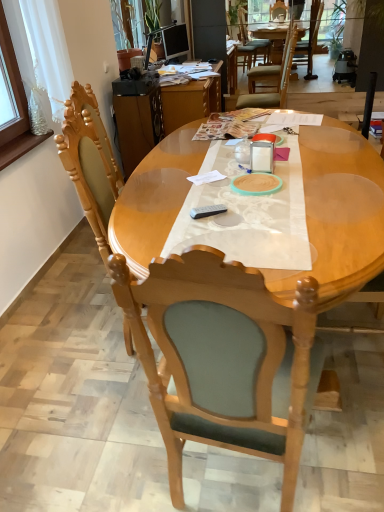
Locate an element on the screen. wooden desk at center is located at coordinates (162, 115).

What do you see at coordinates (223, 360) in the screenshot?
I see `wooden chair at center, which appears as the first chair when viewed from the left` at bounding box center [223, 360].

Describe the element at coordinates (271, 77) in the screenshot. Image resolution: width=384 pixels, height=512 pixels. I see `green fabric chair at upper center, positioned as the 1th chair in back-to-front order` at that location.

You are a GUI agent. You are given a task and a screenshot of the screen. Output one action in this format:
    pyautogui.click(x=<x>, y=<y>)
    Task: Click on the wooden desk at center
    This screenshot has height=512, width=384.
    Given the screenshot: What is the action you would take?
    pyautogui.click(x=162, y=115)

Is there a large distance between wooden chair at center, which is counted as the first chair, starting from the front, and light wood table at center?

Actually, wooden chair at center, which is counted as the first chair, starting from the front, and light wood table at center are a little close together.

Which is more to the left, wooden chair at center, marked as the second chair in a right-to-left arrangement, or light wood table at center?

Positioned to the left is wooden chair at center, marked as the second chair in a right-to-left arrangement.

Is the position of wooden chair at center, marked as the 1th chair in a bottom-to-top arrangement, more distant than that of light wood table at center?

No, wooden chair at center, marked as the 1th chair in a bottom-to-top arrangement, is closer to the camera.

Who is taller, green fabric chair at upper center, which is the 2th chair from left to right, or light wood table at center?

With more height is light wood table at center.

Locate an element on the screen. The height and width of the screenshot is (512, 384). kitchen & dining room table below the green fabric chair at upper center, the 2th chair when ordered from front to back (from the image's perspective) is located at coordinates (338, 214).

Is the position of green fabric chair at upper center, which ranks as the first chair in right-to-left order, less distant than that of light wood table at center?

No, it is not.

Is green fabric chair at upper center, which ranks as the first chair in right-to-left order, positioned with its back to light wood table at center?

green fabric chair at upper center, which ranks as the first chair in right-to-left order, does not have its back to light wood table at center.

Is wooden chair at center, placed as the 2th chair when sorted from back to front, at the right side of wooden desk at center?

Indeed, wooden chair at center, placed as the 2th chair when sorted from back to front, is positioned on the right side of wooden desk at center.

Which of these two, wooden chair at center, which is counted as the first chair, starting from the front, or wooden desk at center, stands taller?

With more height is wooden chair at center, which is counted as the first chair, starting from the front.

Is wooden chair at center, which appears as the first chair when viewed from the left, in contact with wooden desk at center?

There is a gap between wooden chair at center, which appears as the first chair when viewed from the left, and wooden desk at center.

Image resolution: width=384 pixels, height=512 pixels. What are the coordinates of `chair below the wooden desk at center (from the image's perspective)` in the screenshot? It's located at (223, 360).

Can you tell me how much wooden chair at center, placed as the 2th chair when sorted from back to front, and green fabric chair at upper center, which is the 2th chair from left to right, differ in facing direction?

100 degrees.

The width and height of the screenshot is (384, 512). Find the location of `chair below the green fabric chair at upper center, which ranks as the first chair in right-to-left order (from the image's perspective)`. chair below the green fabric chair at upper center, which ranks as the first chair in right-to-left order (from the image's perspective) is located at coordinates (223, 360).

Does point (176, 301) come closer to viewer compared to point (286, 88)?

That is True.

Which object is wider, wooden chair at center, marked as the second chair in a right-to-left arrangement, or green fabric chair at upper center, positioned as the 1th chair in back-to-front order?

green fabric chair at upper center, positioned as the 1th chair in back-to-front order, is wider.

Considering the sizes of wooden desk at center and wooden chair at center, placed as the 2th chair when sorted from back to front, in the image, is wooden desk at center taller or shorter than wooden chair at center, placed as the 2th chair when sorted from back to front,?

Considering their sizes, wooden desk at center has less height than wooden chair at center, placed as the 2th chair when sorted from back to front.

Is point (184, 122) in front of point (122, 286)?

That is False.

Is wooden desk at center facing towards wooden chair at center, which is counted as the first chair, starting from the front?

No, wooden desk at center does not turn towards wooden chair at center, which is counted as the first chair, starting from the front.

Are wooden desk at center and wooden chair at center, which is the 2th chair in top-to-bottom order, far apart?

Yes, wooden desk at center and wooden chair at center, which is the 2th chair in top-to-bottom order, are located far from each other.

Is green fabric chair at upper center, which ranks as the first chair in right-to-left order, positioned beyond the bounds of wooden chair at center, placed as the 2th chair when sorted from back to front?

Yes, green fabric chair at upper center, which ranks as the first chair in right-to-left order, is outside of wooden chair at center, placed as the 2th chair when sorted from back to front.

Considering the points (250, 92) and (189, 251), which point is behind, point (250, 92) or point (189, 251)?

The point (250, 92) is behind.

Is the position of green fabric chair at upper center, positioned as the 2th chair in bottom-to-top order, less distant than that of wooden chair at center, placed as the 2th chair when sorted from back to front?

No, green fabric chair at upper center, positioned as the 2th chair in bottom-to-top order, is behind wooden chair at center, placed as the 2th chair when sorted from back to front.

From the picture: Is green fabric chair at upper center, positioned as the 2th chair in bottom-to-top order, at the left side of wooden chair at center, placed as the 2th chair when sorted from back to front?

In fact, green fabric chair at upper center, positioned as the 2th chair in bottom-to-top order, is to the right of wooden chair at center, placed as the 2th chair when sorted from back to front.

Is wooden desk at center thinner than green fabric chair at upper center, the 2th chair when ordered from front to back?

No.

Can you tell me how much wooden desk at center and green fabric chair at upper center, positioned as the 1th chair in back-to-front order, differ in facing direction?

The facing directions of wooden desk at center and green fabric chair at upper center, positioned as the 1th chair in back-to-front order, are 177 degrees apart.

Are wooden desk at center and green fabric chair at upper center, the 2th chair when ordered from front to back, beside each other?

No, wooden desk at center is not next to green fabric chair at upper center, the 2th chair when ordered from front to back.

Who is smaller, wooden desk at center or green fabric chair at upper center, arranged as the first chair when viewed from the top?

green fabric chair at upper center, arranged as the first chair when viewed from the top.

Locate an element on the screen. Image resolution: width=384 pixels, height=512 pixels. kitchen & dining room table below the wooden chair at center, marked as the second chair in a right-to-left arrangement (from a real-world perspective) is located at coordinates (338, 214).

Locate an element on the screen. Image resolution: width=384 pixels, height=512 pixels. chair behind the light wood table at center is located at coordinates (271, 77).

Looking at the image, which one is located further to wooden desk at center, light wood table at center or wooden chair at center, placed as the 2th chair when sorted from back to front?

wooden chair at center, placed as the 2th chair when sorted from back to front, lies further to wooden desk at center than the other object.

Considering their positions, is wooden chair at center, placed as the 2th chair when sorted from back to front, positioned closer to wooden desk at center than green fabric chair at upper center, arranged as the first chair when viewed from the top?

Among the two, green fabric chair at upper center, arranged as the first chair when viewed from the top, is located nearer to wooden desk at center.

Looking at the image, which one is located closer to green fabric chair at upper center, positioned as the 1th chair in back-to-front order, wooden chair at center, which appears as the first chair when viewed from the left, or light wood table at center?

The object closer to green fabric chair at upper center, positioned as the 1th chair in back-to-front order, is light wood table at center.

When comparing their distances from wooden desk at center, does green fabric chair at upper center, which is the 2th chair from left to right, or wooden chair at center, placed as the 2th chair when sorted from back to front, seem further?

wooden chair at center, placed as the 2th chair when sorted from back to front.

Which object lies further to the anchor point wooden desk at center, light wood table at center or green fabric chair at upper center, arranged as the first chair when viewed from the top?

Among the two, light wood table at center is located further to wooden desk at center.

Based on their spatial positions, is light wood table at center or green fabric chair at upper center, which ranks as the first chair in right-to-left order, closer to wooden chair at center, which appears as the first chair when viewed from the left?

Based on the image, light wood table at center appears to be nearer to wooden chair at center, which appears as the first chair when viewed from the left.

Looking at the image, which one is located further to light wood table at center, wooden desk at center or wooden chair at center, placed as the 2th chair when sorted from back to front?

wooden desk at center is positioned further to the anchor light wood table at center.

Which object lies nearer to the anchor point wooden desk at center, wooden chair at center, which is counted as the first chair, starting from the front, or light wood table at center?

The object closer to wooden desk at center is light wood table at center.

The image size is (384, 512). Identify the location of desk positioned between light wood table at center and green fabric chair at upper center, the 2th chair when ordered from front to back, from near to far. (162, 115).

Where is `desk positioned between wooden chair at center, which appears as the first chair when viewed from the left, and green fabric chair at upper center, the 2th chair when ordered from front to back, from near to far`? desk positioned between wooden chair at center, which appears as the first chair when viewed from the left, and green fabric chair at upper center, the 2th chair when ordered from front to back, from near to far is located at coordinates (162, 115).

Locate an element on the screen. The image size is (384, 512). kitchen & dining room table between wooden chair at center, which is the 2th chair in top-to-bottom order, and green fabric chair at upper center, arranged as the first chair when viewed from the top, from front to back is located at coordinates (338, 214).

This screenshot has width=384, height=512. Identify the location of kitchen & dining room table located between wooden chair at center, which is the 2th chair in top-to-bottom order, and wooden desk at center in the depth direction. (338, 214).